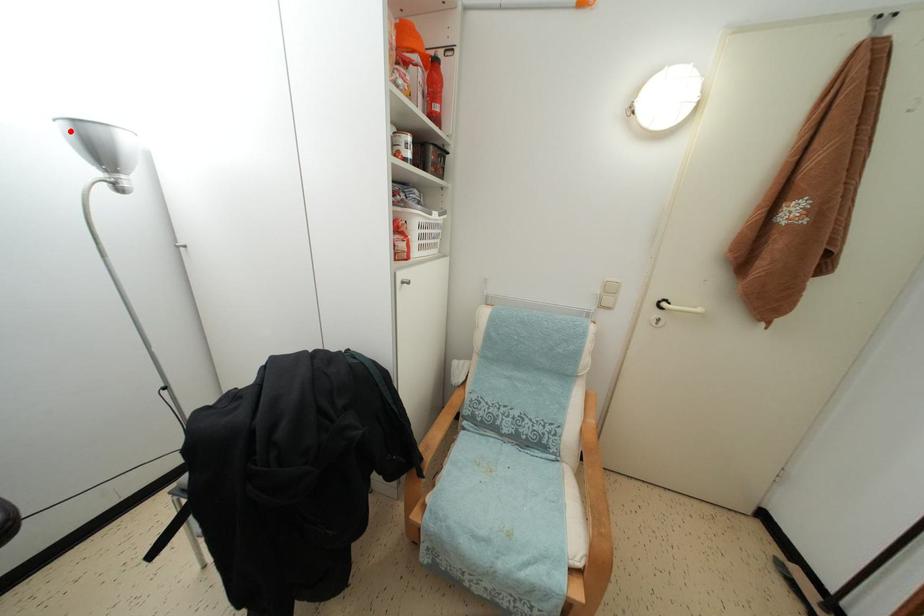
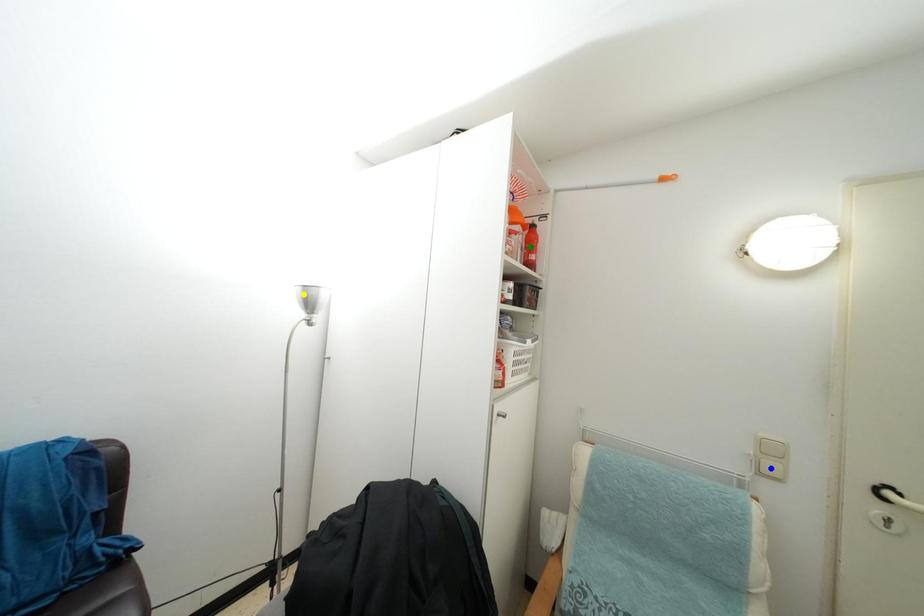
Question: I am providing you with two images of the same scene from different viewpoints. A red point is marked on the first image. You are given multiple points on the second image. Which point in image 2 represents the same 3d spot as the red point in image 1?

Choices:
 (A) green point
 (B) blue point
 (C) yellow point

Answer: (C)